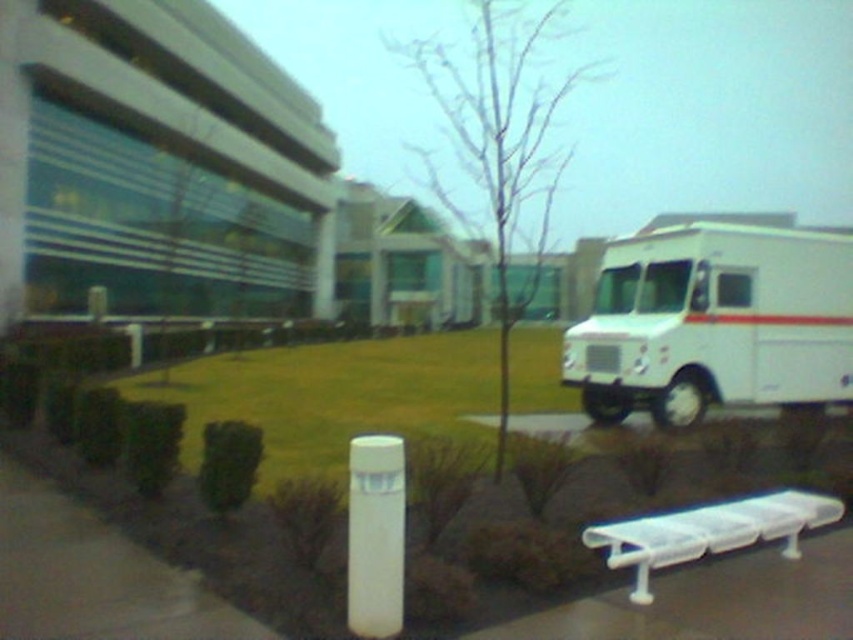
You are a delivery person who needs to park the white matte truck at right close to the white plastic bench at lower right. Given their sizes, will the truck fit in the space next to the bench without overlapping?

The white matte truck at right is larger in size than the white plastic bench at lower right. Therefore, the truck may not fit in the space next to the bench without overlapping, as it is bigger.

You are a maintenance worker needing to move a 15 feet long equipment from the white matte truck at right to the white plastic bench at lower right. Can you move it directly without any obstruction?

The white matte truck at right is 20.19 feet from the white plastic bench at lower right. Since the equipment is 15 feet long, it can be moved directly as the distance between them is sufficient.

You are standing at the point marked as point [714,323] in the image. What object are you currently standing on?

You are standing on the white matte truck at right.